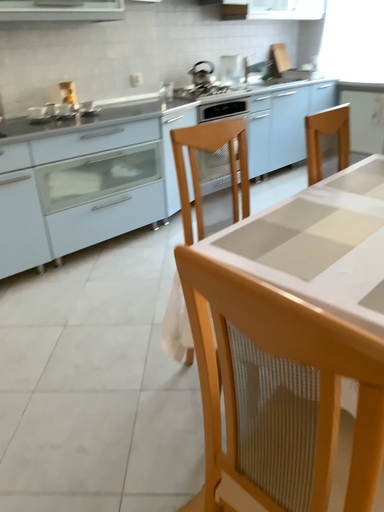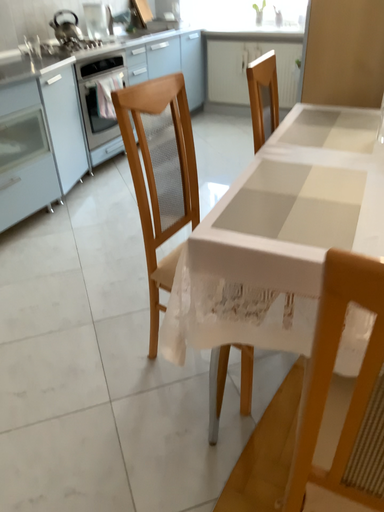
Question: Which way did the camera rotate in the video?

Choices:
 (A) rotated right
 (B) rotated left

Answer: (A)